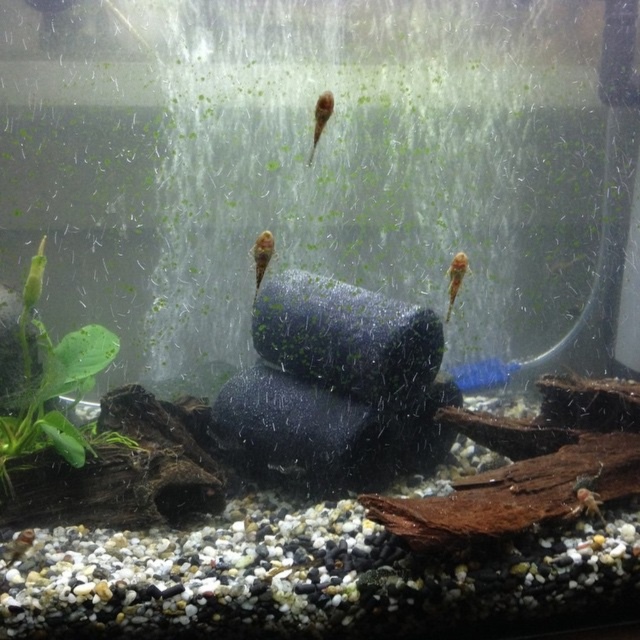
Question: Is green leafy plant at left smaller than translucent gelatinous tadpole at upper center?

Choices:
 (A) no
 (B) yes

Answer: (A)

Question: Can you confirm if green leafy plant at left is smaller than translucent orange fish at center?

Choices:
 (A) no
 (B) yes

Answer: (A)

Question: Which point appears closest to the camera in this image?

Choices:
 (A) (262, 244)
 (B) (461, 273)
 (C) (72, 380)

Answer: (A)

Question: Which is nearer to the translucent gelatinous tadpole at upper center?

Choices:
 (A) green leafy plant at left
 (B) translucent yellowish fish at center
 (C) translucent orange fish at center

Answer: (B)

Question: Can you confirm if translucent yellowish fish at center is thinner than translucent gelatinous tadpole at upper center?

Choices:
 (A) no
 (B) yes

Answer: (A)

Question: Which object is the farthest from the green leafy plant at left?

Choices:
 (A) translucent orange fish at center
 (B) translucent gelatinous tadpole at upper center

Answer: (A)